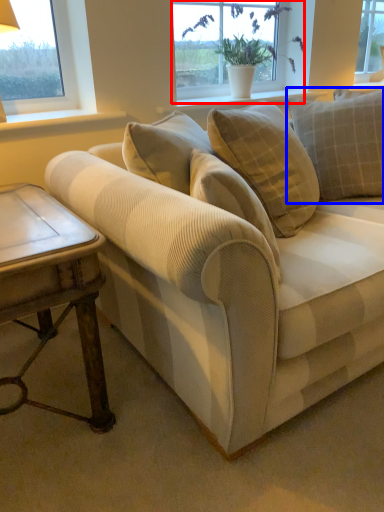
Question: Which point is closer to the camera, window (highlighted by a red box) or pillow (highlighted by a blue box)?

Choices:
 (A) window
 (B) pillow

Answer: (B)